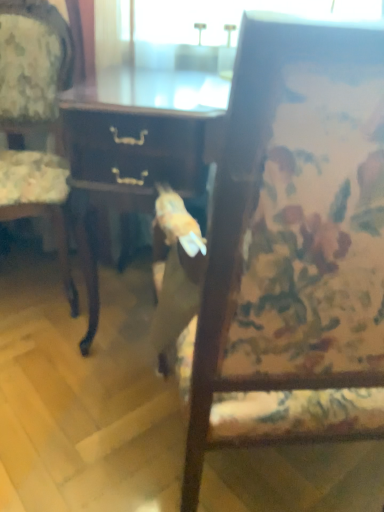
Question: Considering the relative positions of wooden floral-patterned chair at left, placed as the second chair when sorted from right to left, and wooden desk at center in the image provided, is wooden floral-patterned chair at left, placed as the second chair when sorted from right to left, behind wooden desk at center?

Choices:
 (A) yes
 (B) no

Answer: (A)

Question: Considering the relative sizes of wooden floral-patterned chair at left, which appears as the 1th chair when viewed from the left, and wooden desk at center in the image provided, is wooden floral-patterned chair at left, which appears as the 1th chair when viewed from the left, thinner than wooden desk at center?

Choices:
 (A) no
 (B) yes

Answer: (B)

Question: Can you confirm if wooden floral-patterned chair at left, which appears as the 1th chair when viewed from the left, is shorter than wooden desk at center?

Choices:
 (A) yes
 (B) no

Answer: (B)

Question: Is wooden desk at center a part of wooden floral-patterned chair at left, placed as the second chair when sorted from right to left?

Choices:
 (A) yes
 (B) no

Answer: (B)

Question: From the image's perspective, is wooden floral-patterned chair at left, placed as the second chair when sorted from right to left, on top of wooden desk at center?

Choices:
 (A) no
 (B) yes

Answer: (B)

Question: Is wooden chair at center, which is the 2th chair in left-to-right order, spatially inside wooden desk at center, or outside of it?

Choices:
 (A) inside
 (B) outside

Answer: (B)

Question: In terms of width, does wooden chair at center, arranged as the first chair when viewed from the right, look wider or thinner when compared to wooden desk at center?

Choices:
 (A) thin
 (B) wide

Answer: (B)

Question: From the image's perspective, is wooden chair at center, arranged as the first chair when viewed from the right, located above or below wooden desk at center?

Choices:
 (A) below
 (B) above

Answer: (A)

Question: Relative to wooden desk at center, is wooden chair at center, which is the 2th chair in left-to-right order, in front or behind?

Choices:
 (A) front
 (B) behind

Answer: (A)

Question: From a real-world perspective, is wooden floral-patterned chair at left, placed as the second chair when sorted from right to left, physically located above or below wooden chair at center, arranged as the first chair when viewed from the right?

Choices:
 (A) above
 (B) below

Answer: (B)

Question: Is wooden floral-patterned chair at left, placed as the second chair when sorted from right to left, in front of or behind wooden chair at center, arranged as the first chair when viewed from the right, in the image?

Choices:
 (A) front
 (B) behind

Answer: (B)

Question: From the image's perspective, relative to wooden chair at center, which is the 2th chair in left-to-right order, is wooden floral-patterned chair at left, placed as the second chair when sorted from right to left, above or below?

Choices:
 (A) above
 (B) below

Answer: (A)

Question: Is wooden floral-patterned chair at left, which appears as the 1th chair when viewed from the left, spatially inside wooden chair at center, which is the 2th chair in left-to-right order, or outside of it?

Choices:
 (A) inside
 (B) outside

Answer: (B)

Question: From the image's perspective, is wooden desk at center positioned above or below wooden floral-patterned chair at left, placed as the second chair when sorted from right to left?

Choices:
 (A) below
 (B) above

Answer: (A)

Question: In terms of size, does wooden desk at center appear bigger or smaller than wooden floral-patterned chair at left, which appears as the 1th chair when viewed from the left?

Choices:
 (A) big
 (B) small

Answer: (B)